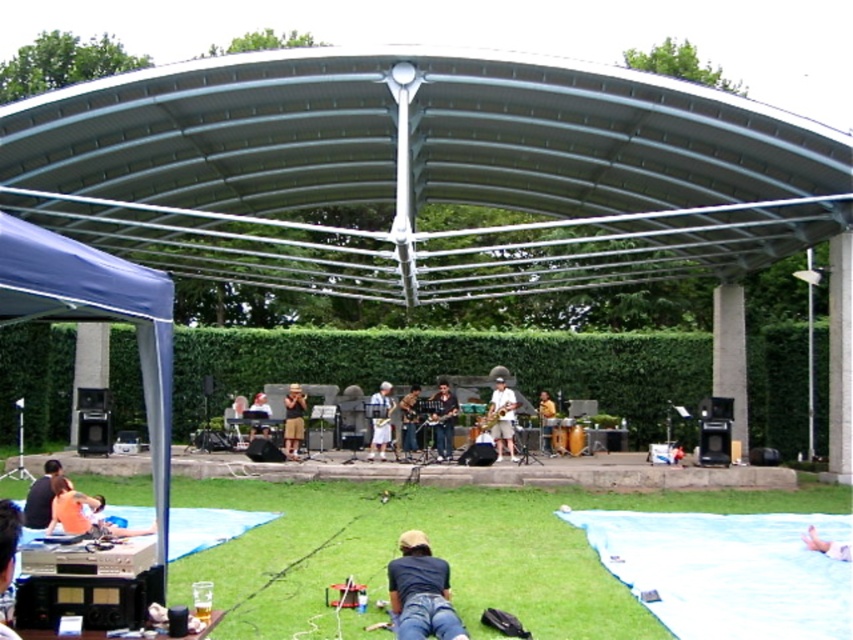
Looking at this image, is metallic gray pergola at center taller than dark blue jeans at lower center?

Yes, metallic gray pergola at center is taller than dark blue jeans at lower center.

Where is `metallic gray pergola at center`? The height and width of the screenshot is (640, 853). metallic gray pergola at center is located at coordinates (421, 172).

At what (x,y) coordinates should I click in order to perform the action: click on metallic gray pergola at center. Please return your answer as a coordinate pair (x, y). Looking at the image, I should click on (421, 172).

Does matte brown saxophone at center appear on the right side of yellow fabric saxophone at center?

Incorrect, matte brown saxophone at center is not on the right side of yellow fabric saxophone at center.

Can you confirm if matte brown saxophone at center is shorter than yellow fabric saxophone at center?

Indeed, matte brown saxophone at center has a lesser height compared to yellow fabric saxophone at center.

Does point (289, 451) lie in front of point (549, 401)?

Yes, it is in front of point (549, 401).

In order to click on matte brown saxophone at center in this screenshot , I will do `click(293, 420)`.

Measure the distance from white fabric blanket at lower right to yellow fabric saxophone at center.

The distance of white fabric blanket at lower right from yellow fabric saxophone at center is 36.71 feet.

Can you confirm if white fabric blanket at lower right is positioned above yellow fabric saxophone at center?

Yes, white fabric blanket at lower right is above yellow fabric saxophone at center.

The image size is (853, 640). What do you see at coordinates (726, 572) in the screenshot?
I see `white fabric blanket at lower right` at bounding box center [726, 572].

Locate an element on the screen. white fabric blanket at lower right is located at coordinates (726, 572).